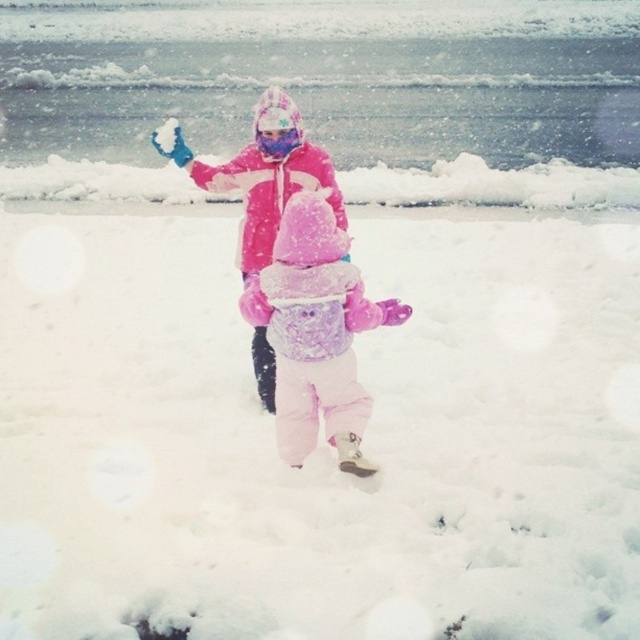
Is point (209, 186) behind point (260, 132)?

Yes.

Find the location of `pink fleece jacket at center`. pink fleece jacket at center is located at coordinates (260, 177).

Is fluffy pink snowsuit at center behind matte pink goggles at center?

No, fluffy pink snowsuit at center is closer to the viewer.

Between point (342, 259) and point (260, 141), which one is positioned in front?

Point (342, 259) is in front.

Locate an element on the screen. This screenshot has height=640, width=640. fluffy pink snowsuit at center is located at coordinates (316, 332).

The width and height of the screenshot is (640, 640). Describe the element at coordinates (316, 332) in the screenshot. I see `fluffy pink snowsuit at center` at that location.

Does fluffy pink snowsuit at center have a larger size compared to pink fleece jacket at center?

Correct, fluffy pink snowsuit at center is larger in size than pink fleece jacket at center.

Describe the element at coordinates (316, 332) in the screenshot. This screenshot has height=640, width=640. I see `fluffy pink snowsuit at center` at that location.

Where is `fluffy pink snowsuit at center`? Image resolution: width=640 pixels, height=640 pixels. fluffy pink snowsuit at center is located at coordinates (316, 332).